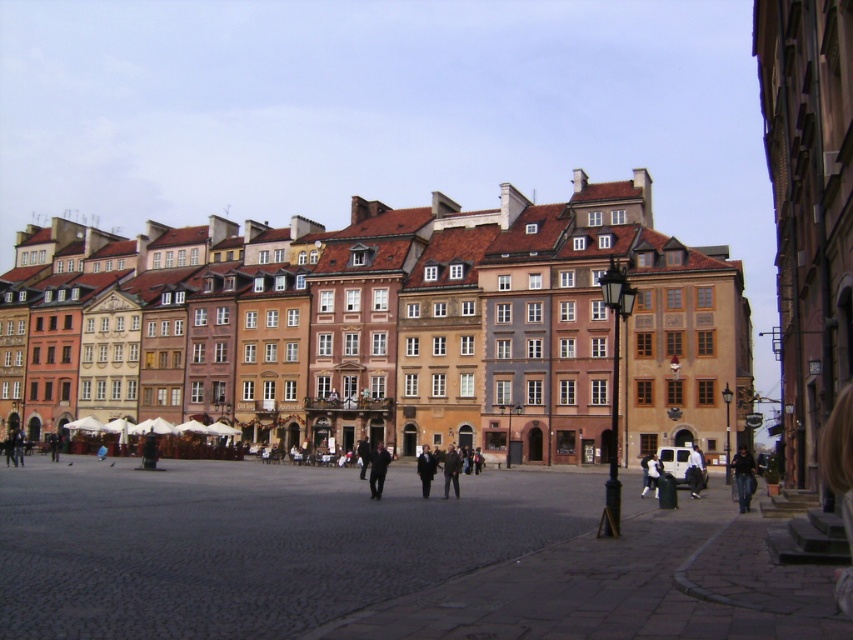
You are a tourist standing at the edge of the cobblestone street in the European town square. You notice two people wearing jackets. One is wearing a dark blue jacket at center and the other a dark gray jacket at center. If you want to approach both individuals to ask for directions, which jacket is closer to you?

The dark blue jacket at center is 4.71 meters away from the dark gray jacket at center. Since you are standing at the edge of the cobblestone street, it depends on their exact positions relative to you. However, without additional information about their distance from your position, I cannot determine which is closer.